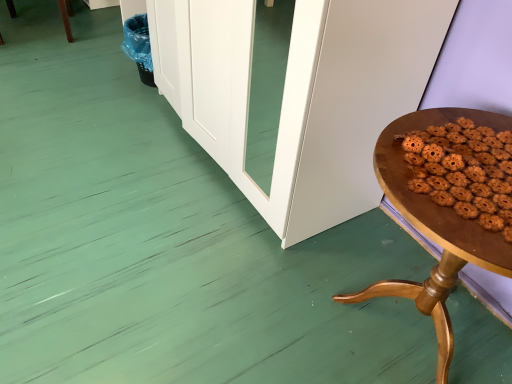
Image resolution: width=512 pixels, height=384 pixels. I want to click on vacant area situated to the left side of wooden table at right, so click(254, 296).